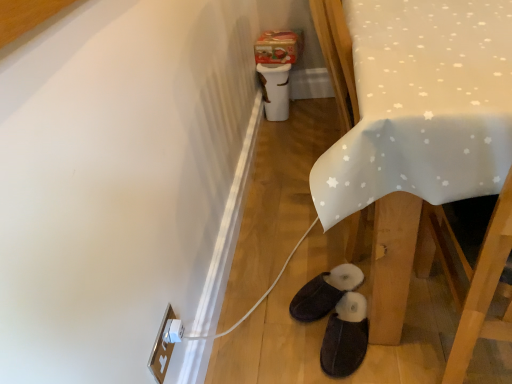
At what (x,y) coordinates should I click in order to perform the action: click on free area in between dark brown suede slippers at lower center, which ranks as the second footwear in back-to-front order, and black suede slippers at lower center, arranged as the second footwear when viewed from the front. Please return your answer as a coordinate pair (x, y). The image size is (512, 384). Looking at the image, I should click on (310, 344).